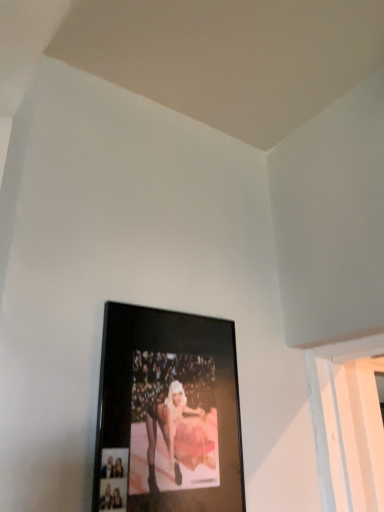
What is the approximate height of black glossy picture frame at upper center?

black glossy picture frame at upper center is 16.14 inches tall.

Where is `black glossy picture frame at upper center`? black glossy picture frame at upper center is located at coordinates (167, 414).

The height and width of the screenshot is (512, 384). Describe the element at coordinates (167, 414) in the screenshot. I see `black glossy picture frame at upper center` at that location.

You are a GUI agent. You are given a task and a screenshot of the screen. Output one action in this format:
    pyautogui.click(x=<x>, y=<y>)
    Task: Click on the black glossy picture frame at upper center
    
    Given the screenshot: What is the action you would take?
    pyautogui.click(x=167, y=414)